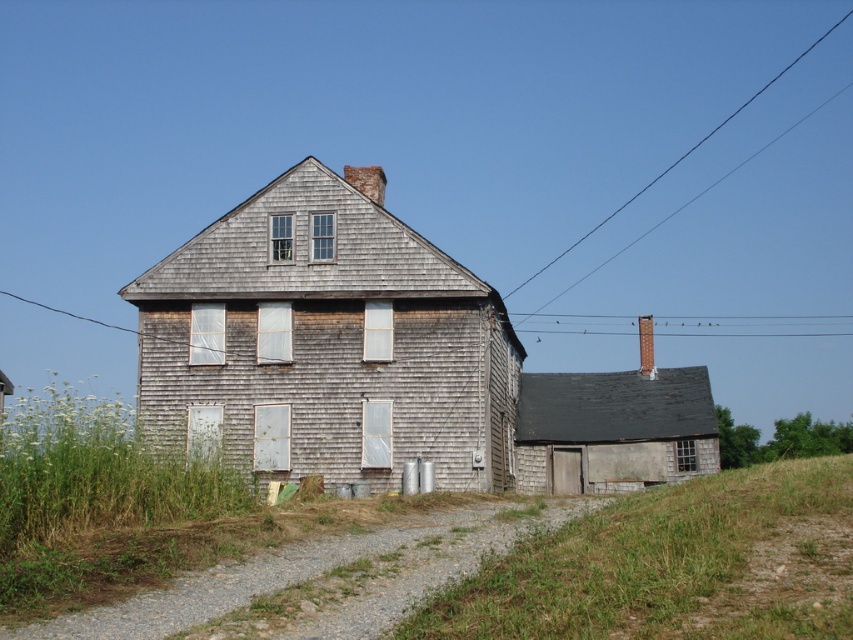
You are standing in front of the house and notice the green grass at lower right and the smooth wire at upper center. Which object is positioned to the left of the other?

The green grass at lower right is positioned to the left of the smooth wire at upper center.

You are standing in front of the two story wooden house. There is a point marked at coordinates (670,564). What is located at this point?

The point marked at coordinates (670,564) indicates the location of green grass at lower right.

You are standing in front of the house and want to walk towards the green grass at lower right. There is a smooth wire at upper center in your path. Will you need to go around the wire or can you walk straight ahead?

The green grass at lower right is closer to the viewer than the smooth wire at upper center, so the wire is further away. You can walk straight ahead as the wire is not blocking your path to the grass.